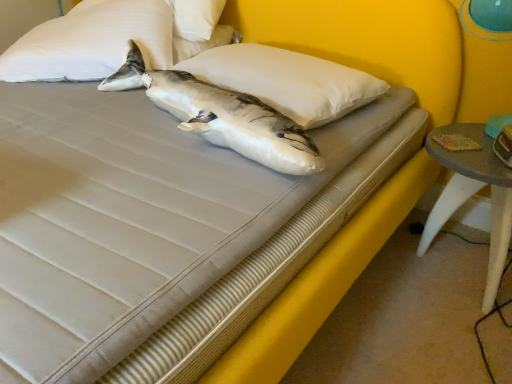
Question: Is point (245, 145) closer or farther from the camera than point (154, 367)?

Choices:
 (A) closer
 (B) farther

Answer: (B)

Question: Considering the positions of white matte shark at center and yellow fabric bed frame at center in the image, is white matte shark at center bigger or smaller than yellow fabric bed frame at center?

Choices:
 (A) big
 (B) small

Answer: (B)

Question: Which of these objects is positioned closest to the white soft pillow at upper left, the 1th pillow viewed from the left?

Choices:
 (A) yellow fabric bed frame at center
 (B) white matte shark at center
 (C) smooth gray table at lower right
 (D) white soft pillow at center, arranged as the 2th pillow when viewed from the left

Answer: (B)

Question: Which is nearer to the yellow fabric bed frame at center?

Choices:
 (A) white matte shark at center
 (B) white soft pillow at upper left, positioned as the 2th pillow in right-to-left order
 (C) white soft pillow at center, positioned as the first pillow in right-to-left order
 (D) smooth gray table at lower right

Answer: (C)